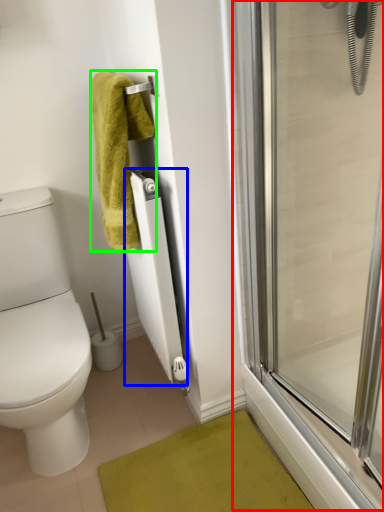
Question: Which object is positioned farthest from screen door (highlighted by a red box)? Select from radiator (highlighted by a blue box) and towel (highlighted by a green box).

Choices:
 (A) radiator
 (B) towel

Answer: (B)